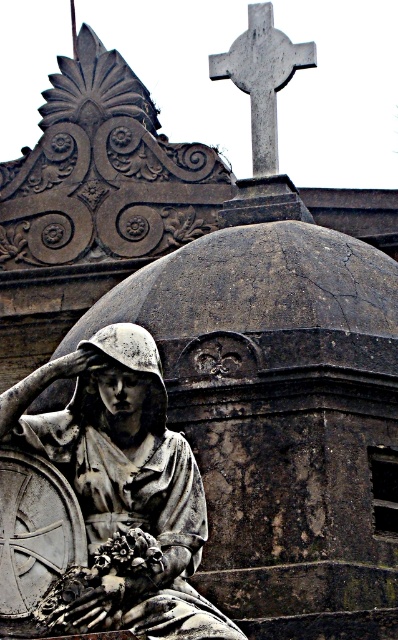
You are an art student analyzing the composition of the image. The matte gray statue at center and the gray stone cross at upper center are both central to the scene. Based on their spatial relationship, which object takes up more visual space in the image?

The gray stone cross at upper center occupies more visual space than the matte gray statue at center, as stated in the description that the matte gray statue at center occupies less space than gray stone cross at upper center.

You are standing in front of the matte gray statue at center and want to take a photo of it. If your camera has a maximum focus range of 130 feet, will it be able to focus on the statue?

The matte gray statue at center is 135.18 feet away from camera, which exceeds the camera maximum focus range of 130 feet. So the camera cannot focus on the statue.